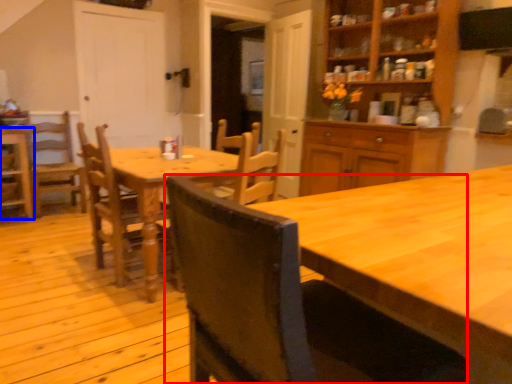
Question: Which object appears closest to the camera in this image, chair (highlighted by a red box) or chair (highlighted by a blue box)?

Choices:
 (A) chair
 (B) chair

Answer: (A)